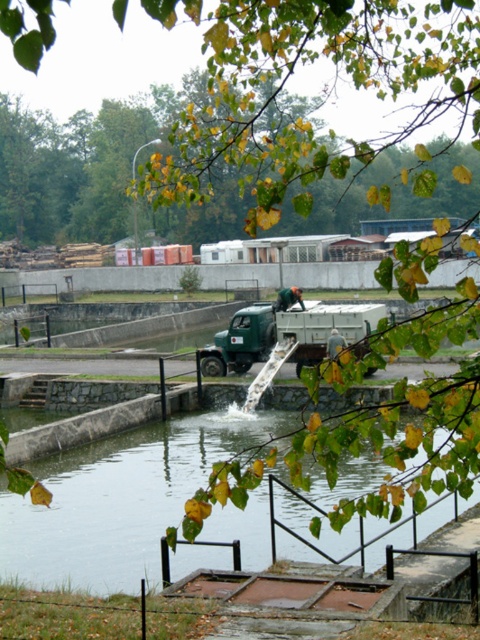
Based on the scene, can you determine if the clear concrete water at center is wider than the green matte truck at center?

The clear concrete water at center might be wider than the green matte truck at center according to the description.

You are a safety inspector checking the scene. You see the clear concrete water at center and the green matte truck at center. Which object is positioned to the left of the other?

The clear concrete water at center is to the left of the green matte truck at center, according to the description provided.

You are a safety inspector checking the scene. The clear concrete water at center and the green matte truck at center are both in your line of sight. Which one is lower in height compared to the other?

The clear concrete water at center is shorter than the green matte truck at center, so the clear concrete water at center is lower in height.